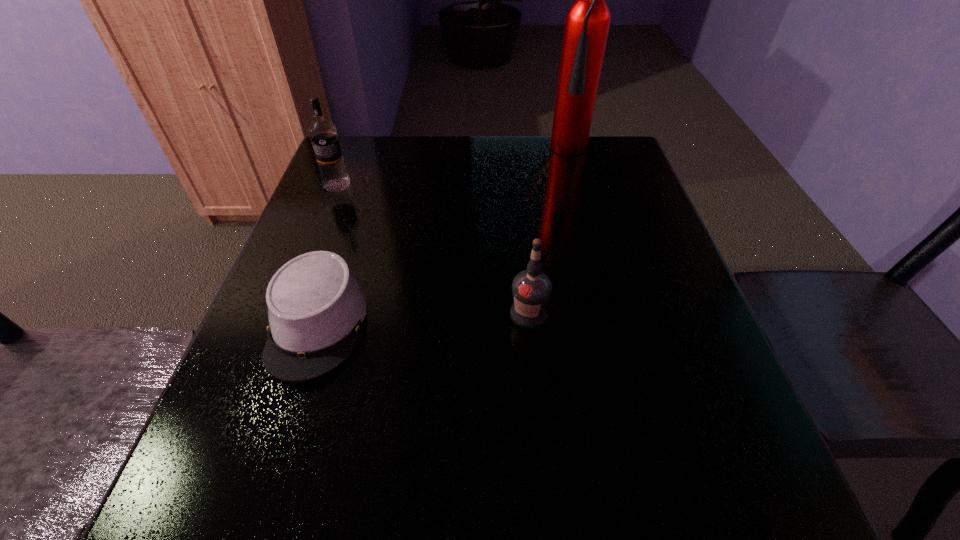
Image resolution: width=960 pixels, height=540 pixels. Find the location of `the tallest object`. the tallest object is located at coordinates (587, 22).

You are a GUI agent. You are given a task and a screenshot of the screen. Output one action in this format:
    pyautogui.click(x=<x>, y=<y>)
    Task: Click on the fire extinguisher
    The height and width of the screenshot is (540, 960).
    Given the screenshot: What is the action you would take?
    pyautogui.click(x=587, y=22)

You are a GUI agent. You are given a task and a screenshot of the screen. Output one action in this format:
    pyautogui.click(x=<x>, y=<y>)
    Task: Click on the farther vodka
    
    Given the screenshot: What is the action you would take?
    pyautogui.click(x=323, y=134)

At what (x,y) coordinates should I click in order to perform the action: click on the left vodka. Please return your answer as a coordinate pair (x, y). Looking at the image, I should click on (323, 134).

Identify the location of the third tallest object. The width and height of the screenshot is (960, 540). (531, 289).

Identify the location of the shorter vodka. (531, 289).

This screenshot has height=540, width=960. What are the coordinates of `the shortest object` in the screenshot? It's located at (316, 306).

At what (x,y) coordinates should I click in order to perform the action: click on vacant space located at the nozzle of the rightmost object. Please return your answer as a coordinate pair (x, y). The height and width of the screenshot is (540, 960). Looking at the image, I should click on (591, 186).

The width and height of the screenshot is (960, 540). Identify the location of blank space located on the label of the left vodka. (314, 245).

At what (x,y) coordinates should I click in order to perform the action: click on vacant space located on the front label of the shorter vodka. Please return your answer as a coordinate pair (x, y). Looking at the image, I should click on (542, 450).